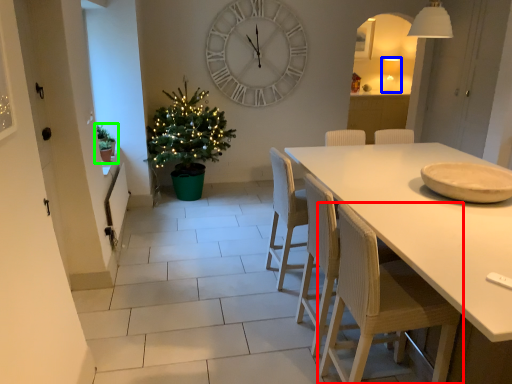
Question: Considering the real-world distances, which object is closest to chair (highlighted by a red box)? lamp (highlighted by a blue box) or houseplant (highlighted by a green box).

Choices:
 (A) lamp
 (B) houseplant

Answer: (B)